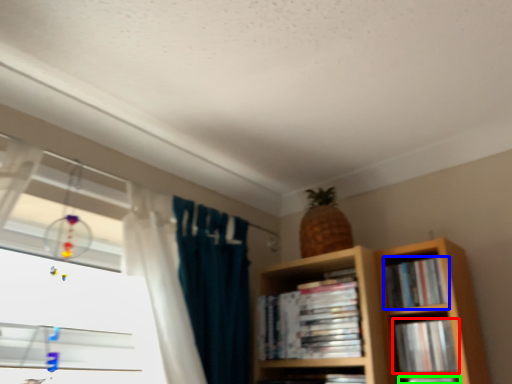
Question: Based on their relative distances, which object is farther from book (highlighted by a red box)? Choose from book (highlighted by a blue box) and book (highlighted by a green box).

Choices:
 (A) book
 (B) book

Answer: (A)